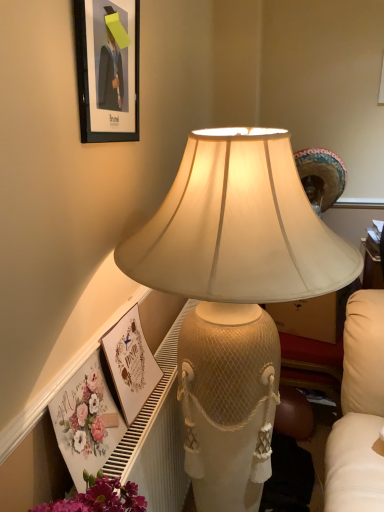
Where is `matte cream lampshade at center`? This screenshot has height=512, width=384. matte cream lampshade at center is located at coordinates (234, 295).

Describe the element at coordinates (107, 69) in the screenshot. This screenshot has width=384, height=512. I see `matte black frame at upper left, which is the 1th picture frame in top-to-bottom order` at that location.

The image size is (384, 512). I want to click on matte cream lampshade at center, so click(x=234, y=295).

Who is shorter, matte black frame at upper left, acting as the second picture frame starting from the bottom, or matte cream lampshade at center?

matte black frame at upper left, acting as the second picture frame starting from the bottom.

Does matte black frame at upper left, acting as the second picture frame starting from the bottom, have a lesser width compared to matte cream lampshade at center?

Yes, matte black frame at upper left, acting as the second picture frame starting from the bottom, is thinner than matte cream lampshade at center.

From the image's perspective, is matte black frame at upper left, which is the 1th picture frame in top-to-bottom order, above or below matte cream lampshade at center?

From the image's perspective, matte black frame at upper left, which is the 1th picture frame in top-to-bottom order, appears above matte cream lampshade at center.

Which object is further away from the camera taking this photo, matte black frame at upper left, which is the 1th picture frame in top-to-bottom order, or matte cream lampshade at center?

matte black frame at upper left, which is the 1th picture frame in top-to-bottom order, is behind.

This screenshot has height=512, width=384. Identify the location of picture frame to the left of matte white picture frame at lower center, the second picture frame positioned from the top. (107, 69).

Based on the photo, is matte white picture frame at lower center, the second picture frame positioned from the top, wider or thinner than matte black frame at upper left, which is the 1th picture frame in top-to-bottom order?

In the image, matte white picture frame at lower center, the second picture frame positioned from the top, appears to be wider than matte black frame at upper left, which is the 1th picture frame in top-to-bottom order.

Consider the image. Can you confirm if matte white picture frame at lower center, the 1th picture frame positioned from the bottom, is bigger than matte black frame at upper left, acting as the second picture frame starting from the bottom?

Yes, matte white picture frame at lower center, the 1th picture frame positioned from the bottom, is bigger than matte black frame at upper left, acting as the second picture frame starting from the bottom.

From the image's perspective, which object appears higher, matte white picture frame at lower center, the 1th picture frame positioned from the bottom, or matte black frame at upper left, acting as the second picture frame starting from the bottom?

matte black frame at upper left, acting as the second picture frame starting from the bottom.

Is matte black frame at upper left, acting as the second picture frame starting from the bottom, touching matte white picture frame at lower center, the second picture frame positioned from the top?

No, matte black frame at upper left, acting as the second picture frame starting from the bottom, is not in contact with matte white picture frame at lower center, the second picture frame positioned from the top.

Where is `picture frame behind the matte black frame at upper left, acting as the second picture frame starting from the bottom`? picture frame behind the matte black frame at upper left, acting as the second picture frame starting from the bottom is located at coordinates (130, 362).

Considering the positions of objects matte black frame at upper left, which is the 1th picture frame in top-to-bottom order, and matte white picture frame at lower center, the 1th picture frame positioned from the bottom, in the image provided, who is more to the left, matte black frame at upper left, which is the 1th picture frame in top-to-bottom order, or matte white picture frame at lower center, the 1th picture frame positioned from the bottom,?

From the viewer's perspective, matte black frame at upper left, which is the 1th picture frame in top-to-bottom order, appears more on the left side.

Consider the image. How much distance is there between matte black frame at upper left, which is the 1th picture frame in top-to-bottom order, and matte white picture frame at lower center, the second picture frame positioned from the top?

matte black frame at upper left, which is the 1th picture frame in top-to-bottom order, is 24.21 inches away from matte white picture frame at lower center, the second picture frame positioned from the top.

Is matte white picture frame at lower center, the 1th picture frame positioned from the bottom, in front of or behind matte cream lampshade at center in the image?

matte white picture frame at lower center, the 1th picture frame positioned from the bottom, is behind matte cream lampshade at center.

Does matte white picture frame at lower center, the 1th picture frame positioned from the bottom, appear on the right side of matte cream lampshade at center?

Incorrect, matte white picture frame at lower center, the 1th picture frame positioned from the bottom, is not on the right side of matte cream lampshade at center.

In the scene shown: Is matte white picture frame at lower center, the second picture frame positioned from the top, aimed at matte cream lampshade at center?

Yes, matte white picture frame at lower center, the second picture frame positioned from the top, faces towards matte cream lampshade at center.

Would you consider matte white picture frame at lower center, the second picture frame positioned from the top, to be distant from matte cream lampshade at center?

matte white picture frame at lower center, the second picture frame positioned from the top, is near matte cream lampshade at center, not far away.

Considering the relative sizes of matte cream lampshade at center and matte white picture frame at lower center, the 1th picture frame positioned from the bottom, in the image provided, is matte cream lampshade at center shorter than matte white picture frame at lower center, the 1th picture frame positioned from the bottom,?

No.

Relative to matte white picture frame at lower center, the 1th picture frame positioned from the bottom, is matte cream lampshade at center in front or behind?

Clearly, matte cream lampshade at center is in front of matte white picture frame at lower center, the 1th picture frame positioned from the bottom.

From a real-world perspective, is matte cream lampshade at center physically below matte white picture frame at lower center, the second picture frame positioned from the top?

Yes, from a real-world perspective, matte cream lampshade at center is under matte white picture frame at lower center, the second picture frame positioned from the top.

Is matte white picture frame at lower center, the 1th picture frame positioned from the bottom, at the back of matte cream lampshade at center?

Yes, matte cream lampshade at center's orientation is away from matte white picture frame at lower center, the 1th picture frame positioned from the bottom.

Which point is more distant from viewer, (351, 278) or (105, 121)?

Positioned behind is point (105, 121).

Can you confirm if matte cream lampshade at center is bigger than matte black frame at upper left, acting as the second picture frame starting from the bottom?

Yes.

Between matte cream lampshade at center and matte black frame at upper left, acting as the second picture frame starting from the bottom, which one has more height?

matte cream lampshade at center is taller.

From a real-world perspective, starting from the matte cream lampshade at center, which picture frame is the 2nd one vertically above it? Please provide its 2D coordinates.

[(107, 69)]

Where is `picture frame that appears below the matte black frame at upper left, which is the 1th picture frame in top-to-bottom order (from the image's perspective)`? picture frame that appears below the matte black frame at upper left, which is the 1th picture frame in top-to-bottom order (from the image's perspective) is located at coordinates (130, 362).

Which object lies further to the anchor point matte cream lampshade at center, matte black frame at upper left, acting as the second picture frame starting from the bottom, or matte white picture frame at lower center, the second picture frame positioned from the top?

matte white picture frame at lower center, the second picture frame positioned from the top.

Considering their positions, is matte black frame at upper left, which is the 1th picture frame in top-to-bottom order, positioned further to matte white picture frame at lower center, the 1th picture frame positioned from the bottom, than matte cream lampshade at center?

Among the two, matte black frame at upper left, which is the 1th picture frame in top-to-bottom order, is located further to matte white picture frame at lower center, the 1th picture frame positioned from the bottom.

When comparing their distances from matte white picture frame at lower center, the 1th picture frame positioned from the bottom, does matte cream lampshade at center or matte black frame at upper left, which is the 1th picture frame in top-to-bottom order, seem closer?

Based on the image, matte cream lampshade at center appears to be nearer to matte white picture frame at lower center, the 1th picture frame positioned from the bottom.

Estimate the real-world distances between objects in this image. Which object is closer to matte cream lampshade at center, matte white picture frame at lower center, the second picture frame positioned from the top, or matte black frame at upper left, acting as the second picture frame starting from the bottom?

Result: matte black frame at upper left, acting as the second picture frame starting from the bottom, lies closer to matte cream lampshade at center than the other object.

Based on their spatial positions, is matte white picture frame at lower center, the second picture frame positioned from the top, or matte cream lampshade at center closer to matte black frame at upper left, which is the 1th picture frame in top-to-bottom order?

Based on the image, matte cream lampshade at center appears to be nearer to matte black frame at upper left, which is the 1th picture frame in top-to-bottom order.

Looking at the image, which one is located closer to matte black frame at upper left, acting as the second picture frame starting from the bottom, matte cream lampshade at center or matte white picture frame at lower center, the 1th picture frame positioned from the bottom?

matte cream lampshade at center lies closer to matte black frame at upper left, acting as the second picture frame starting from the bottom, than the other object.

What are the coordinates of `picture frame between matte black frame at upper left, which is the 1th picture frame in top-to-bottom order, and matte cream lampshade at center vertically` in the screenshot? It's located at (130, 362).